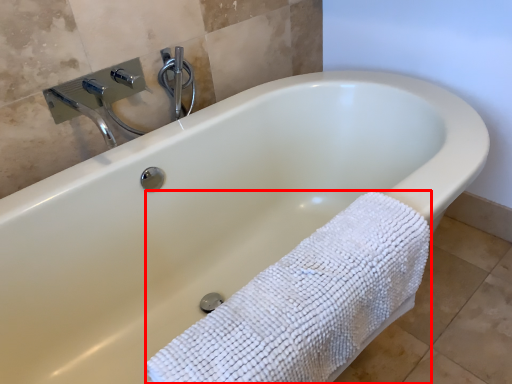
Question: Where is bath towel (annotated by the red box) located in relation to shower in the image?

Choices:
 (A) left
 (B) right

Answer: (B)